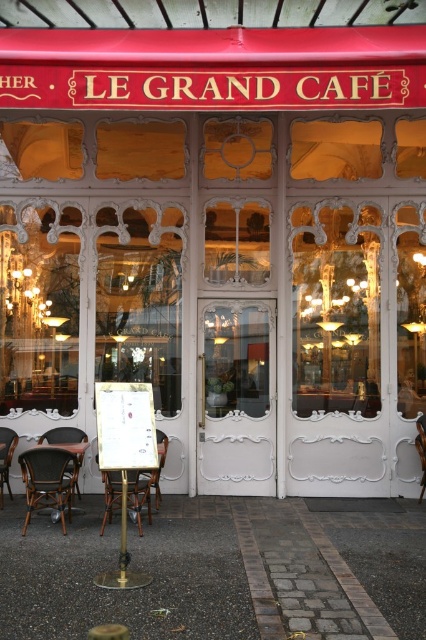
Who is more forward, [132,500] or [158,496]?

Point [132,500] is more forward.

Does metallic gold chair at lower left appear on the right side of wooden chair at center?

In fact, metallic gold chair at lower left is to the left of wooden chair at center.

Is point (143, 502) positioned behind point (157, 440)?

No, it is not.

This screenshot has width=426, height=640. Find the location of `metallic gold chair at lower left`. metallic gold chair at lower left is located at coordinates (138, 497).

Who is higher up, brown wicker chair at lower left or wooden chair at center?

wooden chair at center is above.

Identify the location of brown wicker chair at lower left. (48, 481).

Is point (140, 520) positioned before point (2, 496)?

Yes, it is.

Between point (126, 497) and point (0, 426), which one is positioned behind?

The point (0, 426) is behind.

Identify the location of metallic gold chair at lower left. This screenshot has height=640, width=426. (138, 497).

The height and width of the screenshot is (640, 426). Find the location of `metallic gold chair at lower left`. metallic gold chair at lower left is located at coordinates (138, 497).